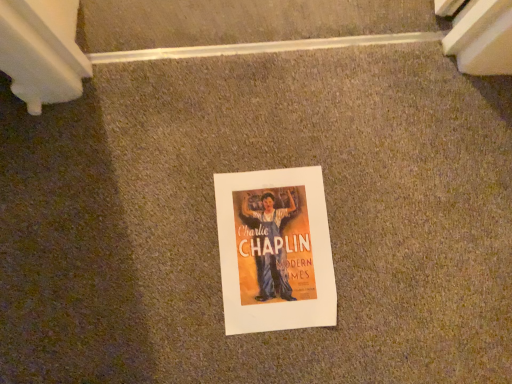
The image size is (512, 384). I want to click on free location above white paper poster at center (from a real-world perspective), so click(272, 247).